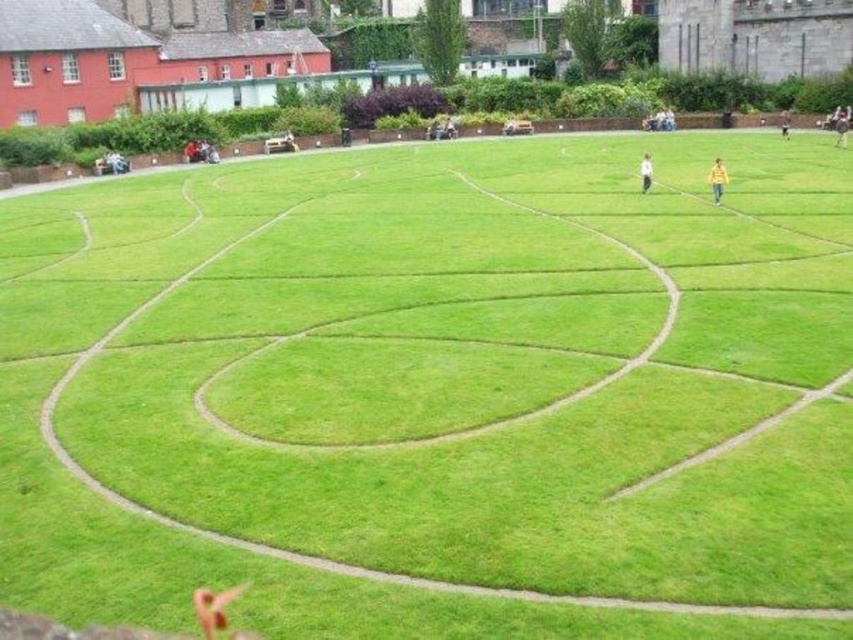
Between yellow fabric person at center and brown leather jacket at upper right, which one is positioned lower?

yellow fabric person at center

Does yellow fabric person at center have a larger size compared to brown leather jacket at upper right?

Correct, yellow fabric person at center is larger in size than brown leather jacket at upper right.

The height and width of the screenshot is (640, 853). What do you see at coordinates (717, 179) in the screenshot?
I see `yellow fabric person at center` at bounding box center [717, 179].

In order to click on yellow fabric person at center in this screenshot , I will do `click(717, 179)`.

Locate an element on the screen. yellow fabric person at center is located at coordinates (717, 179).

Can you confirm if yellow fabric person at center is shorter than white fabric person at center?

Incorrect, yellow fabric person at center's height does not fall short of white fabric person at center's.

Where is `yellow fabric person at center`? The width and height of the screenshot is (853, 640). yellow fabric person at center is located at coordinates (717, 179).

Is yellow fabric person at center to the right of yellow fabric person at right from the viewer's perspective?

No, yellow fabric person at center is not to the right of yellow fabric person at right.

Who is more forward, (717, 192) or (846, 129)?

Point (717, 192)

Find the location of `yellow fabric person at center`. yellow fabric person at center is located at coordinates (717, 179).